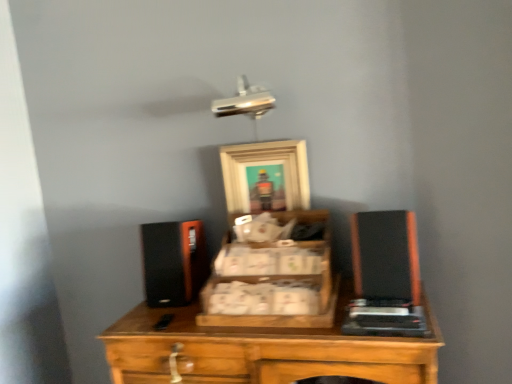
Question: Is wooden picture frame at center at the left side of wooden crate at center?

Choices:
 (A) yes
 (B) no

Answer: (A)

Question: From the image's perspective, is wooden picture frame at center over wooden crate at center?

Choices:
 (A) yes
 (B) no

Answer: (A)

Question: Is wooden picture frame at center oriented towards wooden crate at center?

Choices:
 (A) yes
 (B) no

Answer: (A)

Question: Does wooden picture frame at center appear on the right side of wooden crate at center?

Choices:
 (A) no
 (B) yes

Answer: (A)

Question: Can you confirm if wooden picture frame at center is taller than wooden crate at center?

Choices:
 (A) yes
 (B) no

Answer: (A)

Question: Is wooden picture frame at center behind wooden crate at center?

Choices:
 (A) no
 (B) yes

Answer: (B)

Question: From the image's perspective, is black matte speaker at right below wooden crate at center?

Choices:
 (A) yes
 (B) no

Answer: (B)

Question: Is black matte speaker at right turned away from wooden crate at center?

Choices:
 (A) no
 (B) yes

Answer: (A)

Question: Are black matte speaker at right and wooden crate at center located far from each other?

Choices:
 (A) no
 (B) yes

Answer: (A)

Question: Considering the relative positions of black matte speaker at right and wooden crate at center in the image provided, is black matte speaker at right to the right of wooden crate at center from the viewer's perspective?

Choices:
 (A) no
 (B) yes

Answer: (B)

Question: Is black matte speaker at right thinner than wooden crate at center?

Choices:
 (A) yes
 (B) no

Answer: (A)

Question: Is black matte speaker at right facing towards wooden crate at center?

Choices:
 (A) no
 (B) yes

Answer: (A)

Question: Could you tell me if wooden crate at center is facing wooden picture frame at center?

Choices:
 (A) no
 (B) yes

Answer: (A)